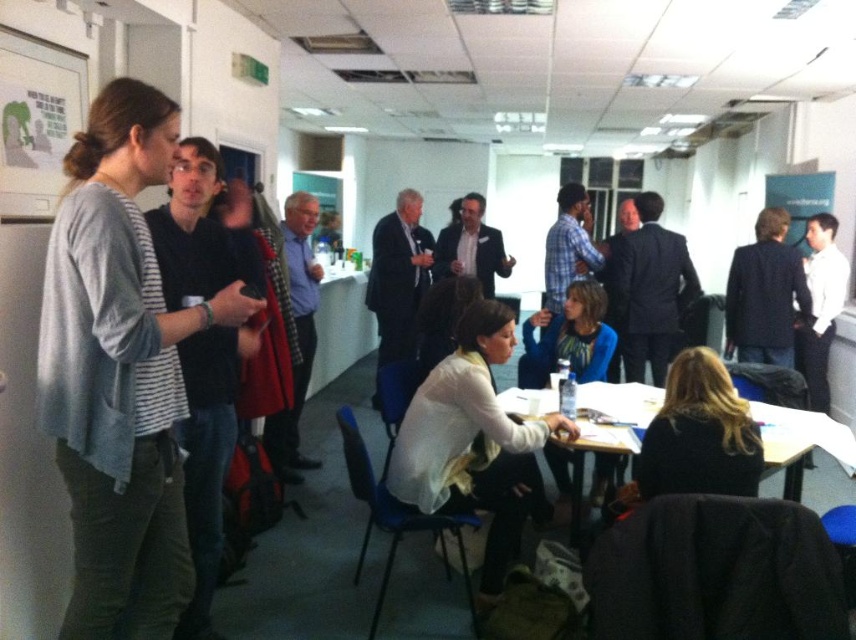
In the scene shown: You are a person who is 5 feet tall and want to walk from the light gray sweater at left to the blue fabric jacket at center. Can you walk straight through the space between them without bending down?

The distance between the light gray sweater at left and blue fabric jacket at center is 7.24 feet, so yes, you can walk straight through the space between them without bending down since the height is not an issue here.

You are standing at the point marked as point (138, 604) and want to move to the other side of the room. There is an obstacle 1.5 meters away from you. Can you safely navigate around it without getting too close?

The distance between you and the obstacle is 1.5 meters, which is less than the 2.06 meters separating the two points. Therefore, you need to move carefully to avoid the obstacle, maintaining a safe distance.